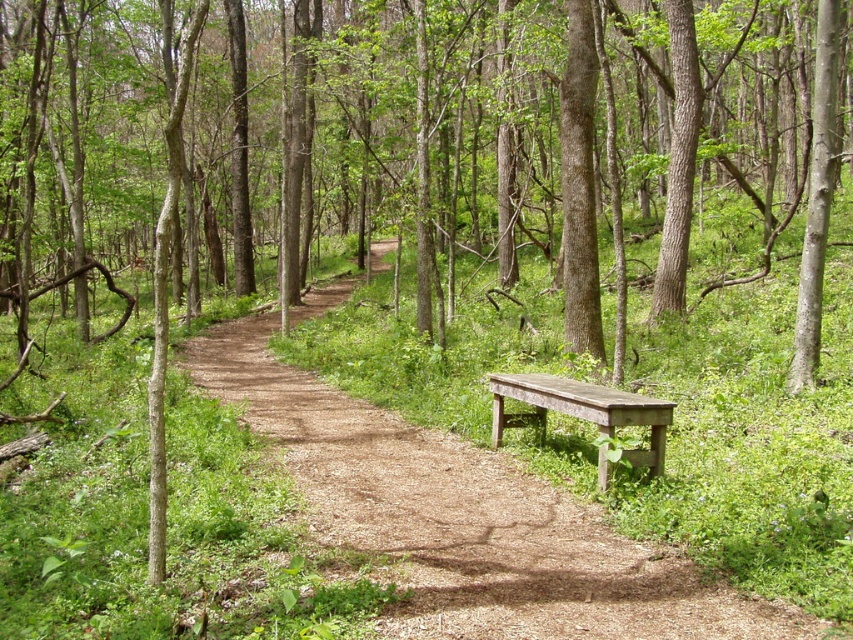
You are a hiker walking along the dirt path in the forest scene. You see two benches at the right side of the path. Which bench, the wooden bench at right or the weathered wood bench at right, is closer to you?

The wooden bench at right is closer to you since it is in front of the weathered wood bench at right.

You are a hiker who wants to rest on the benches in the forest. There are two benches available, the wooden bench at right and the weathered wood bench at right. Which bench is closer to the left side of the path?

The wooden bench at right is positioned on the left side of weathered wood bench at right, so the wooden bench at right is closer to the left side of the path.